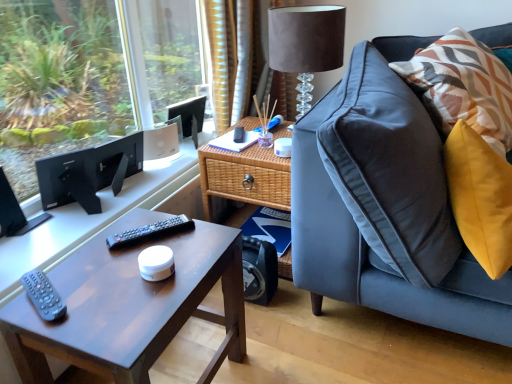
Where is `free space above matte brown coffee table at lower left (from a real-world perspective)`? This screenshot has width=512, height=384. free space above matte brown coffee table at lower left (from a real-world perspective) is located at coordinates (128, 264).